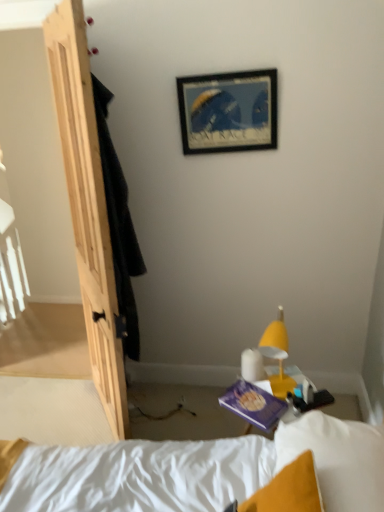
Image resolution: width=384 pixels, height=512 pixels. What do you see at coordinates (228, 111) in the screenshot?
I see `wooden picture frame at upper center` at bounding box center [228, 111].

Locate an element on the screen. yellow matte lamp at lower right is located at coordinates (276, 354).

At what (x,y) coordinates should I click in order to perform the action: click on purple matte paperback book at lower center. Please return your answer as a coordinate pair (x, y). This screenshot has width=384, height=512. Looking at the image, I should click on (254, 405).

Which of these two, wooden picture frame at upper center or purple matte paperback book at lower center, stands taller?

wooden picture frame at upper center is taller.

Which of these two, wooden picture frame at upper center or purple matte paperback book at lower center, is smaller?

purple matte paperback book at lower center.

Is point (271, 114) less distant than point (228, 397)?

No, (271, 114) is further to viewer.

From the picture: Considering their positions, is wooden picture frame at upper center located in front of or behind purple matte paperback book at lower center?

In the image, wooden picture frame at upper center appears behind purple matte paperback book at lower center.

In the image, there is a natural wood door at left. Where is `paperback book below it (from the image's perspective)`? This screenshot has height=512, width=384. paperback book below it (from the image's perspective) is located at coordinates (254, 405).

Is purple matte paperback book at lower center facing away from natural wood door at left?

No, purple matte paperback book at lower center's orientation is not away from natural wood door at left.

Considering the relative sizes of purple matte paperback book at lower center and natural wood door at left in the image provided, is purple matte paperback book at lower center bigger than natural wood door at left?

Incorrect, purple matte paperback book at lower center is not larger than natural wood door at left.

Is natural wood door at left inside purple matte paperback book at lower center?

Definitely not — natural wood door at left is not inside purple matte paperback book at lower center.

From the image's perspective, is natural wood door at left over yellow matte lamp at lower right?

Yes, from the image's perspective, natural wood door at left is over yellow matte lamp at lower right.

Which object is further away from the camera, natural wood door at left or yellow matte lamp at lower right?

natural wood door at left is more distant.

Can you confirm if natural wood door at left is shorter than yellow matte lamp at lower right?

In fact, natural wood door at left may be taller than yellow matte lamp at lower right.

Based on their positions, is natural wood door at left located to the left or right of yellow matte lamp at lower right?

natural wood door at left is positioned on yellow matte lamp at lower right's left side.

Which of these two, yellow matte lamp at lower right or purple matte paperback book at lower center, stands shorter?

purple matte paperback book at lower center is shorter.

Does yellow matte lamp at lower right have a lesser width compared to purple matte paperback book at lower center?

Indeed, yellow matte lamp at lower right has a lesser width compared to purple matte paperback book at lower center.

How far apart are yellow matte lamp at lower right and purple matte paperback book at lower center?

5.36 inches.

At what (x,y) coordinates should I click in order to perform the action: click on paperback book below the yellow matte lamp at lower right (from a real-world perspective). Please return your answer as a coordinate pair (x, y). The height and width of the screenshot is (512, 384). Looking at the image, I should click on (254, 405).

Considering the sizes of objects natural wood door at left and wooden picture frame at upper center in the image provided, who is shorter, natural wood door at left or wooden picture frame at upper center?

wooden picture frame at upper center is shorter.

From the image's perspective, relative to wooden picture frame at upper center, is natural wood door at left above or below?

Clearly, from the image's perspective, natural wood door at left is below wooden picture frame at upper center.

Which is in front, natural wood door at left or wooden picture frame at upper center?

wooden picture frame at upper center is more forward.

In the image, there is a purple matte paperback book at lower center. Where is `light fixture above it (from the image's perspective)`? Image resolution: width=384 pixels, height=512 pixels. light fixture above it (from the image's perspective) is located at coordinates (276, 354).

Would you consider purple matte paperback book at lower center to be distant from yellow matte lamp at lower right?

No, purple matte paperback book at lower center is not far from yellow matte lamp at lower right.

Can you tell me how much purple matte paperback book at lower center and yellow matte lamp at lower right differ in facing direction?

The facing directions of purple matte paperback book at lower center and yellow matte lamp at lower right are 70.3 degrees apart.

Is purple matte paperback book at lower center at the right side of yellow matte lamp at lower right?

In fact, purple matte paperback book at lower center is to the left of yellow matte lamp at lower right.

Is purple matte paperback book at lower center at the back of natural wood door at left?

No.

You are a GUI agent. You are given a task and a screenshot of the screen. Output one action in this format:
    pyautogui.click(x=<x>, y=<y>)
    Task: Click on the paperback book below the natural wood door at left (from a real-world perspective)
    The height and width of the screenshot is (512, 384).
    Given the screenshot: What is the action you would take?
    pyautogui.click(x=254, y=405)

Does natural wood door at left have a lesser height compared to purple matte paperback book at lower center?

Incorrect, the height of natural wood door at left does not fall short of that of purple matte paperback book at lower center.

From a real-world perspective, between natural wood door at left and purple matte paperback book at lower center, who is vertically higher?

From a 3D spatial view, natural wood door at left is above.

Where is `picture frame on the left of purple matte paperback book at lower center`? picture frame on the left of purple matte paperback book at lower center is located at coordinates (228, 111).

Locate an element on the screen. The height and width of the screenshot is (512, 384). paperback book in front of the natural wood door at left is located at coordinates (254, 405).

When comparing their distances from natural wood door at left, does yellow matte lamp at lower right or wooden picture frame at upper center seem further?

yellow matte lamp at lower right lies further to natural wood door at left than the other object.

Estimate the real-world distances between objects in this image. Which object is further from yellow matte lamp at lower right, natural wood door at left or purple matte paperback book at lower center?

natural wood door at left lies further to yellow matte lamp at lower right than the other object.

Estimate the real-world distances between objects in this image. Which object is closer to wooden picture frame at upper center, yellow matte lamp at lower right or purple matte paperback book at lower center?

yellow matte lamp at lower right lies closer to wooden picture frame at upper center than the other object.

Looking at the image, which one is located closer to wooden picture frame at upper center, yellow matte lamp at lower right or natural wood door at left?

Among the two, natural wood door at left is located nearer to wooden picture frame at upper center.

In the scene shown: When comparing their distances from yellow matte lamp at lower right, does purple matte paperback book at lower center or wooden picture frame at upper center seem closer?

purple matte paperback book at lower center is closer to yellow matte lamp at lower right.

Considering their positions, is natural wood door at left positioned closer to yellow matte lamp at lower right than wooden picture frame at upper center?

natural wood door at left is positioned closer to the anchor yellow matte lamp at lower right.

Looking at the image, which one is located further to yellow matte lamp at lower right, wooden picture frame at upper center or natural wood door at left?

The object further to yellow matte lamp at lower right is wooden picture frame at upper center.

Estimate the real-world distances between objects in this image. Which object is closer to wooden picture frame at upper center, natural wood door at left or purple matte paperback book at lower center?

Based on the image, natural wood door at left appears to be nearer to wooden picture frame at upper center.

Identify the location of paperback book between natural wood door at left and yellow matte lamp at lower right from left to right. pyautogui.click(x=254, y=405).

You are a GUI agent. You are given a task and a screenshot of the screen. Output one action in this format:
    pyautogui.click(x=<x>, y=<y>)
    Task: Click on the picture frame situated between natural wood door at left and purple matte paperback book at lower center from left to right
    
    Given the screenshot: What is the action you would take?
    pyautogui.click(x=228, y=111)

Locate an element on the screen. This screenshot has height=512, width=384. picture frame between natural wood door at left and yellow matte lamp at lower right from left to right is located at coordinates (228, 111).

Find the location of a particular element. This screenshot has height=512, width=384. light fixture that lies between wooden picture frame at upper center and purple matte paperback book at lower center from top to bottom is located at coordinates (276, 354).